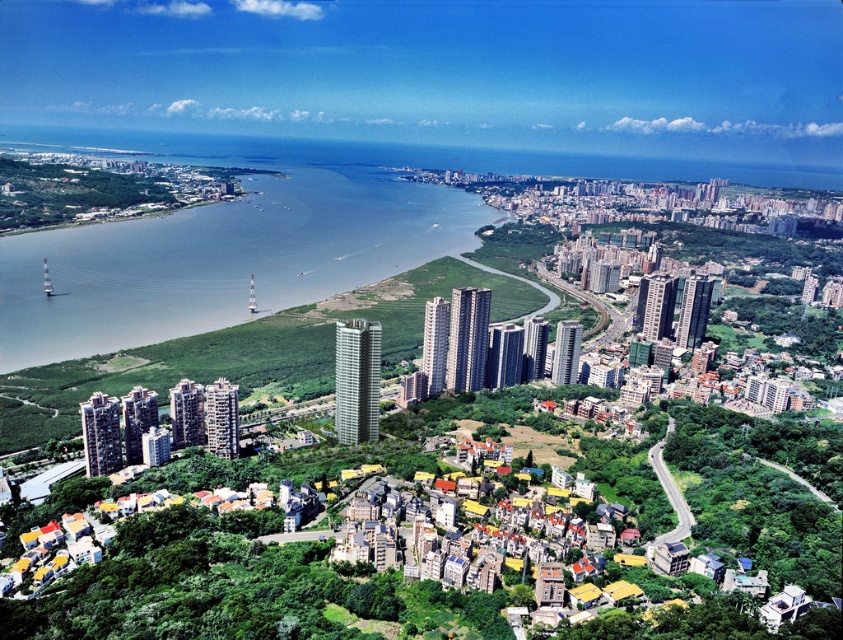
You are a drone operator tasked with capturing aerial footage of the coastal urban landscape. Your drone has a maximum flight range of 400 meters. Based on the scene, can your drone safely reach the gray water at center without exceeding its range?

Result: The gray water at center is 436.16 meters from the camera, which exceeds the drone operator drone maximum flight range of 400 meters. Therefore, the drone cannot safely reach the gray water at center without exceeding its range.

You are standing at the top of a hill overlooking the coastal urban landscape. You see the gray water at center and the green grassy hillside at lower left. Which object is positioned to the left of the other?

The gray water at center is to the left of the green grassy hillside at lower left according to the description.

You are a drone operator planning to fly a drone from the green grassy hillside at lower left to the gray water at center. Based on the scene, will the drone need to ascend or descend to reach its destination?

The gray water at center is taller than the green grassy hillside at lower left, so the drone will need to ascend to reach the gray water at center from the green grassy hillside at lower left.